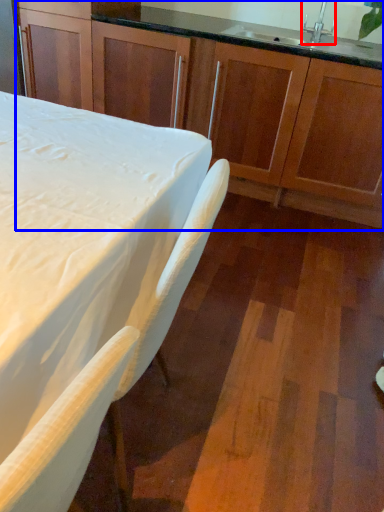
Question: Which point is closer to the camera, faucet (highlighted by a red box) or cabinetry (highlighted by a blue box)?

Choices:
 (A) faucet
 (B) cabinetry

Answer: (B)